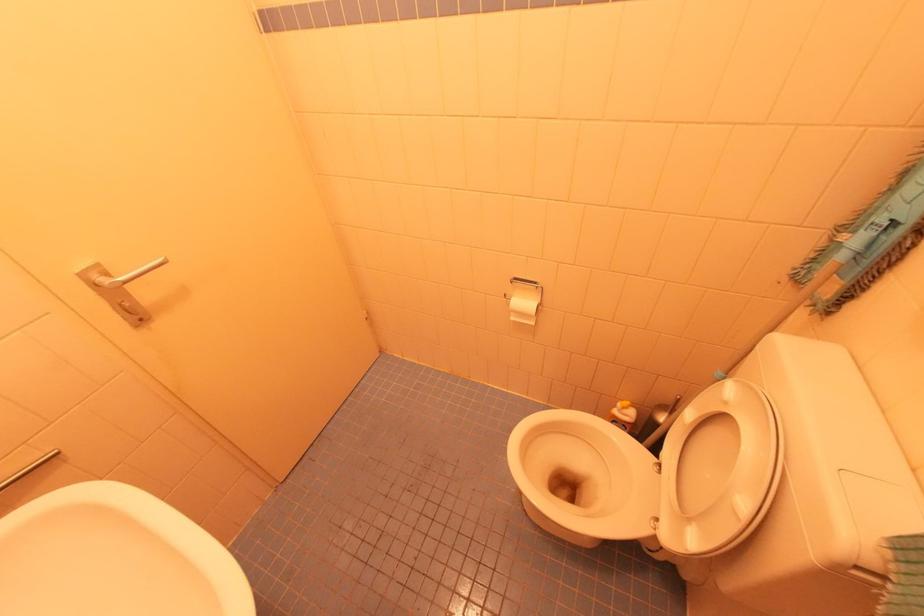
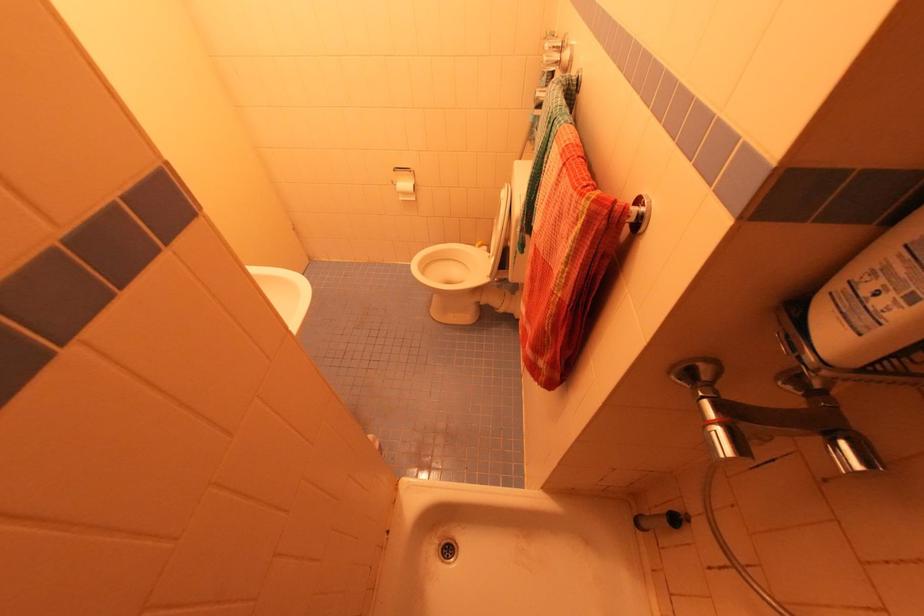
Question: How did the camera likely rotate?

Choices:
 (A) Left
 (B) Right
 (C) Up
 (D) Down

Answer: (B)